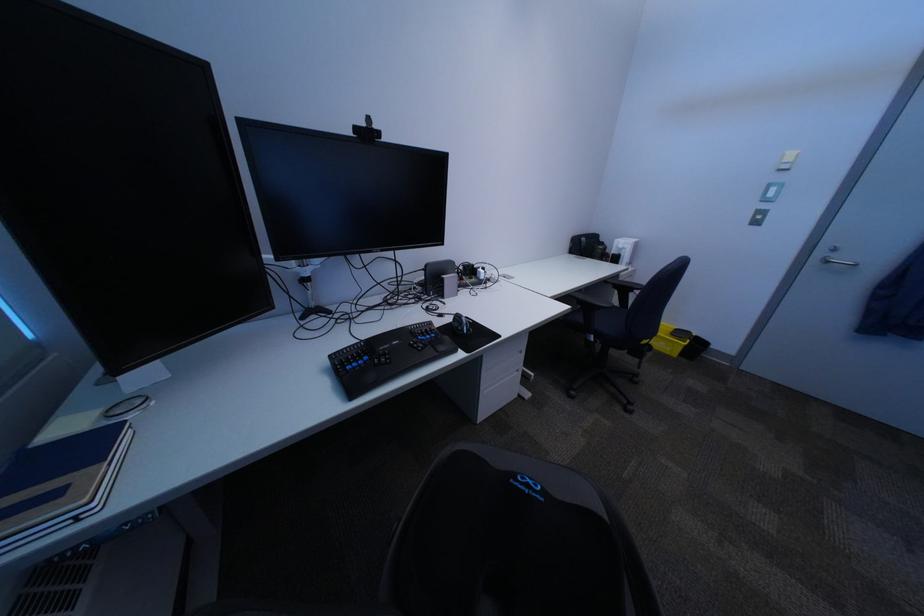
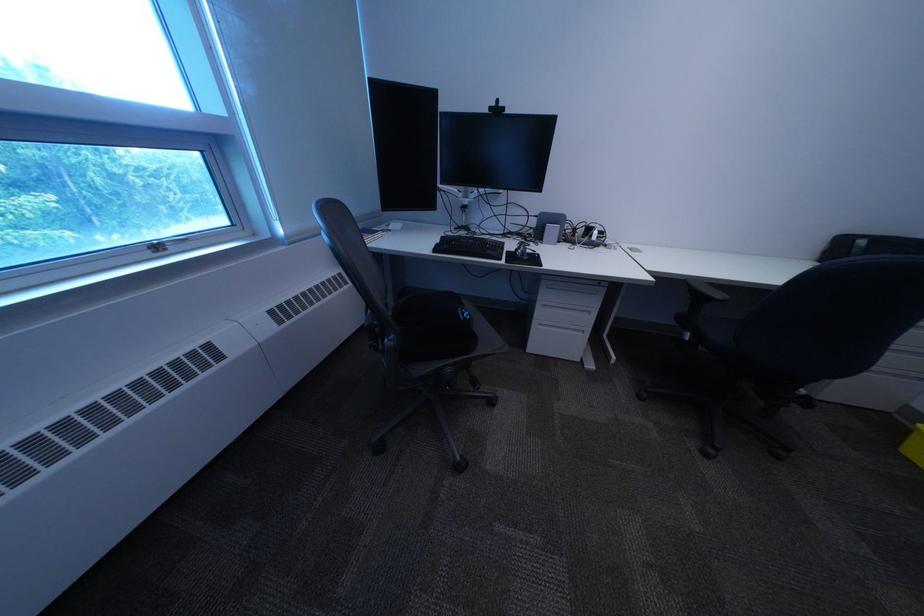
Where in the second image is the point corresponding to point 608,338 from the first image?

(704, 336)